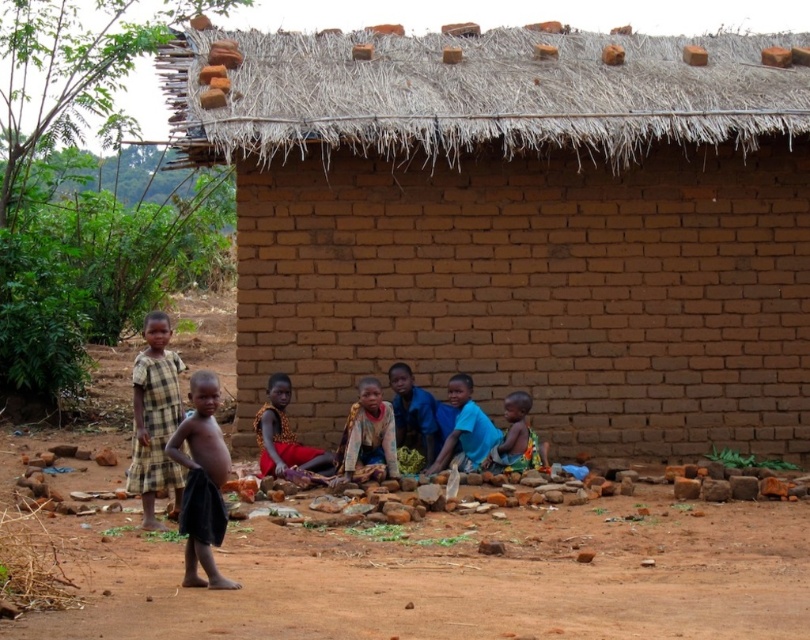
You are a photographer standing in front of the brick structure with the thatched roof. You notice two points marked in the scene. Which point, point (354, 150) or point (292, 458), is closer to you?

Point (354, 150) is further to the viewer than point (292, 458), so point (292, 458) is closer to you.

Based on the scene described, where is the thatched straw roof at upper center located relative to the black cloth at left?

The thatched straw roof at upper center is located to the right of the black cloth at left.